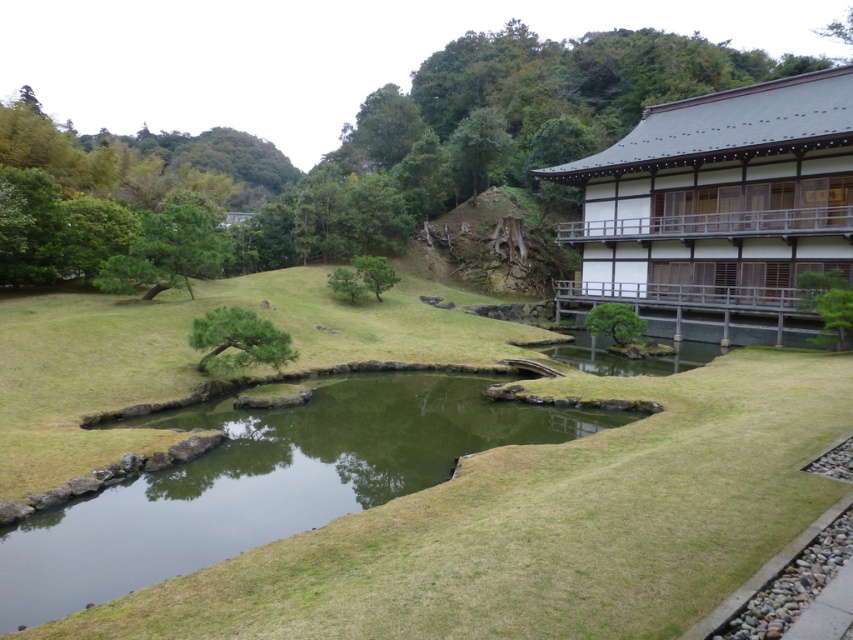
You are standing in the Japanese garden and want to take a photo. You notice two points in the scene labeled as point 1 at coordinates (622, 116) and point 2 at coordinates (358, 266). Which point is closer to your camera position?

Point 1 at coordinates (622, 116) is closer to the camera position because it is further to the camera than point 2 at coordinates (358, 266).